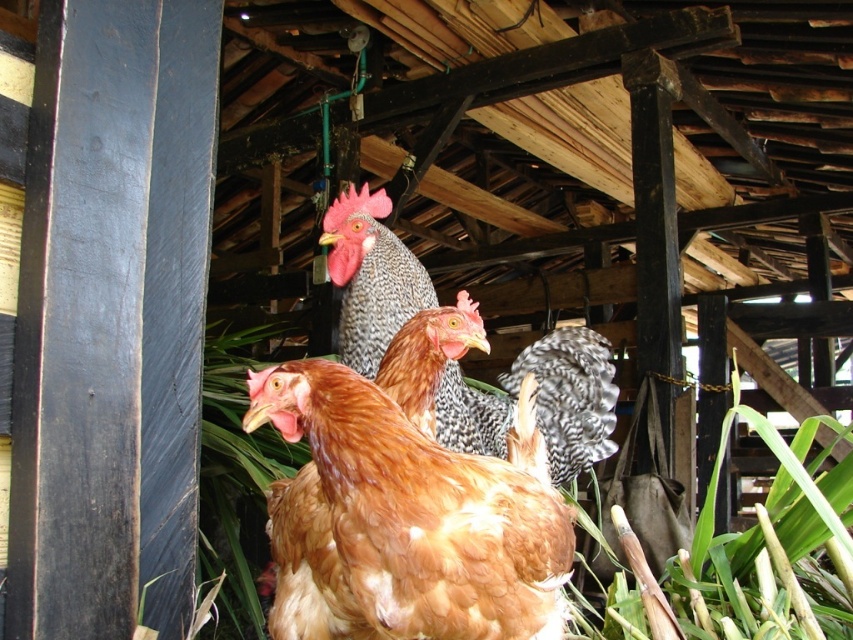
You are a farmer who wants to identify the tallest bird among the speckled feathered chicken at center and the speckled feathered rooster at center. Which one is taller?

The speckled feathered rooster at center is taller than the speckled feathered chicken at center.

You are standing in the barn and want to locate the brown feathered chicken at center. According to the coordinates provided, where exactly is it positioned?

The brown feathered chicken at center is positioned at coordinates point [425,509].